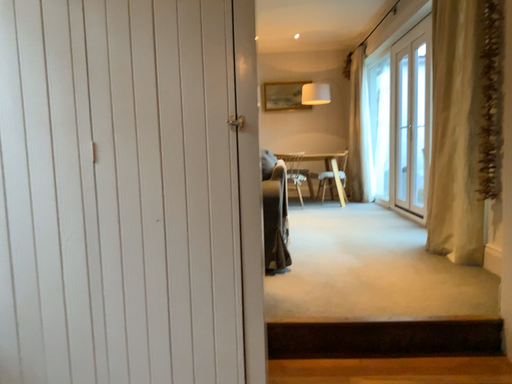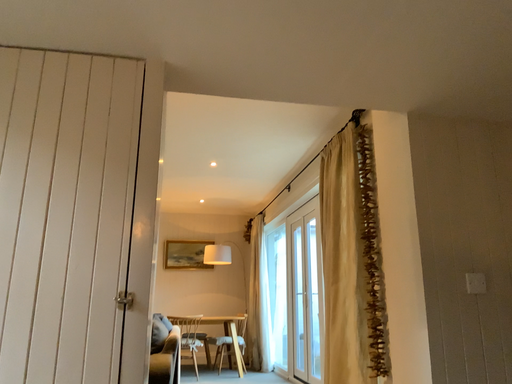
Question: How did the camera likely rotate when shooting the video?

Choices:
 (A) rotated left
 (B) rotated right

Answer: (B)